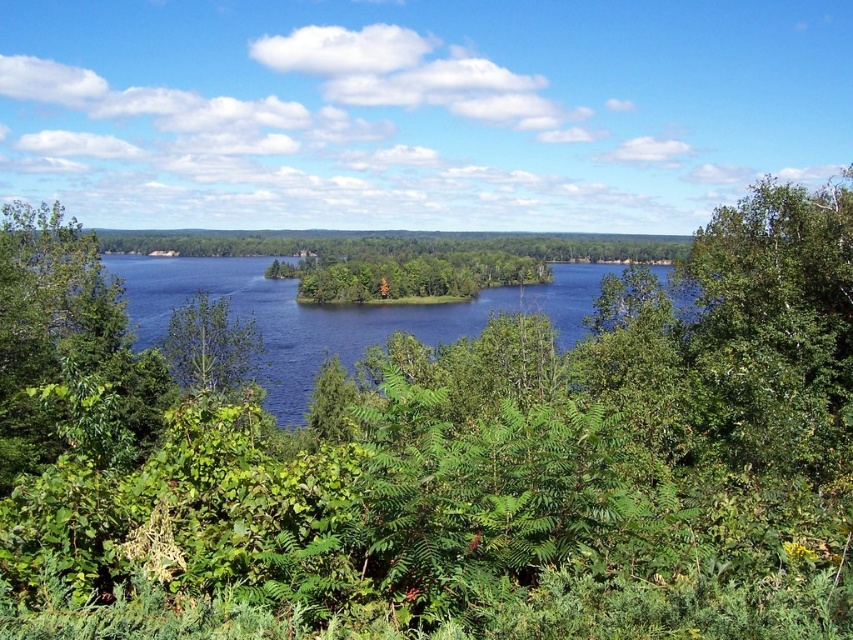
Can you confirm if green leafy tree at left is positioned to the left of green leafy tree at center?

Indeed, green leafy tree at left is positioned on the left side of green leafy tree at center.

Which is above, green leafy tree at left or green leafy tree at center?

green leafy tree at center

Is point (67, 243) in front of point (200, 392)?

No, (67, 243) is further to viewer.

Find the location of a particular element. The image size is (853, 640). green leafy tree at left is located at coordinates (62, 337).

Does blue water at center have a greater width compared to green leafy tree at center?

Correct, the width of blue water at center exceeds that of green leafy tree at center.

Does blue water at center have a greater height compared to green leafy tree at center?

Yes.

Is point (280, 285) positioned in front of point (200, 316)?

No, it is behind (200, 316).

At what (x,y) coordinates should I click in order to perform the action: click on blue water at center. Please return your answer as a coordinate pair (x, y). Looking at the image, I should click on (334, 314).

Is green leafy tree at left wider than blue water at center?

No, green leafy tree at left is not wider than blue water at center.

Who is more distant from viewer, [142,380] or [265,364]?

Positioned behind is point [265,364].

Is point (20, 387) positioned before point (206, 285)?

Yes, point (20, 387) is in front of point (206, 285).

The height and width of the screenshot is (640, 853). Identify the location of green leafy tree at left. (62, 337).